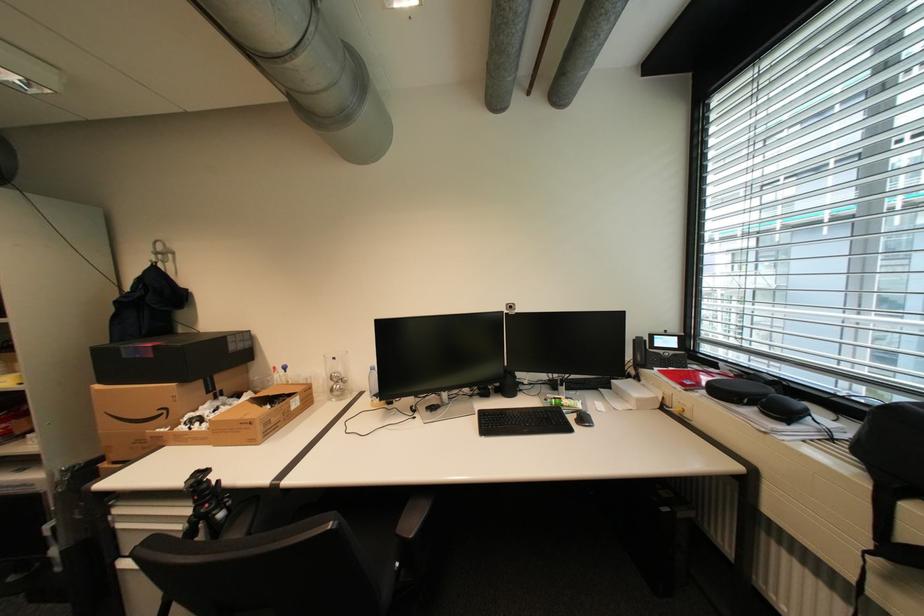
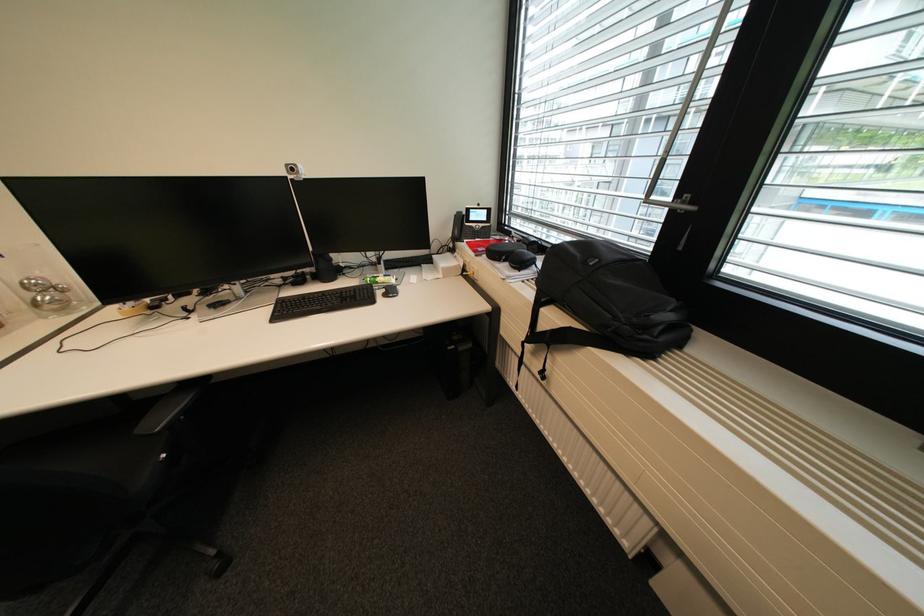
Based on the continuous images, in which direction is the camera rotating?

The rotation direction of the camera is right-down.